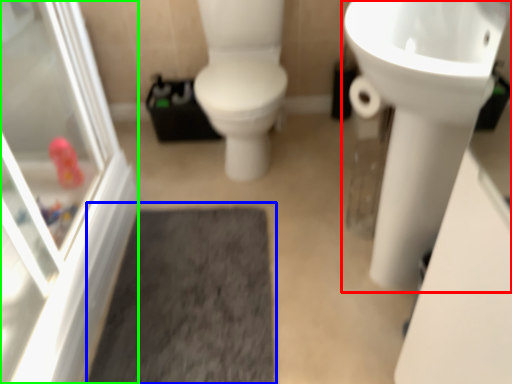
Question: Which object is positioned closest to sink (highlighted by a red box)? Select from bath mat (highlighted by a blue box) and screen door (highlighted by a green box).

Choices:
 (A) bath mat
 (B) screen door

Answer: (A)